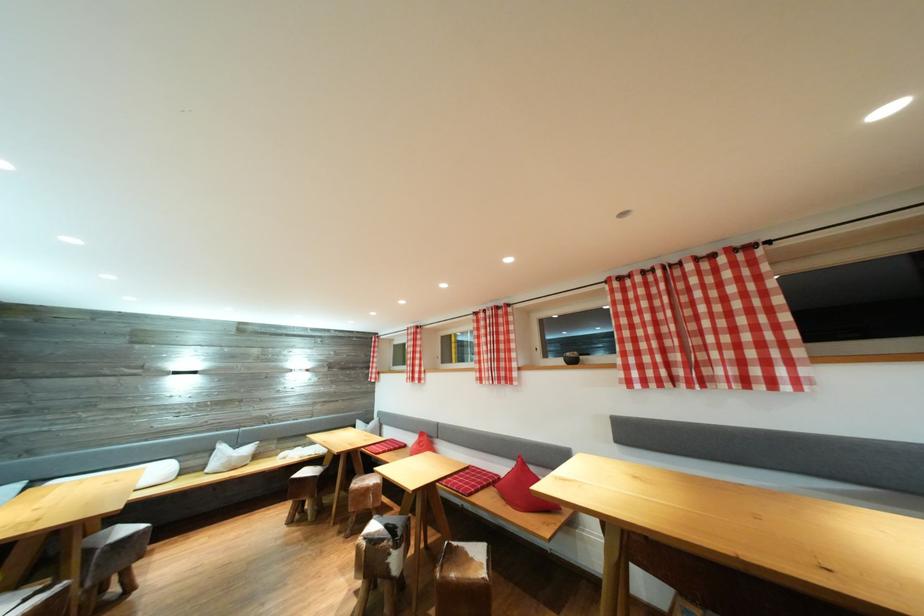
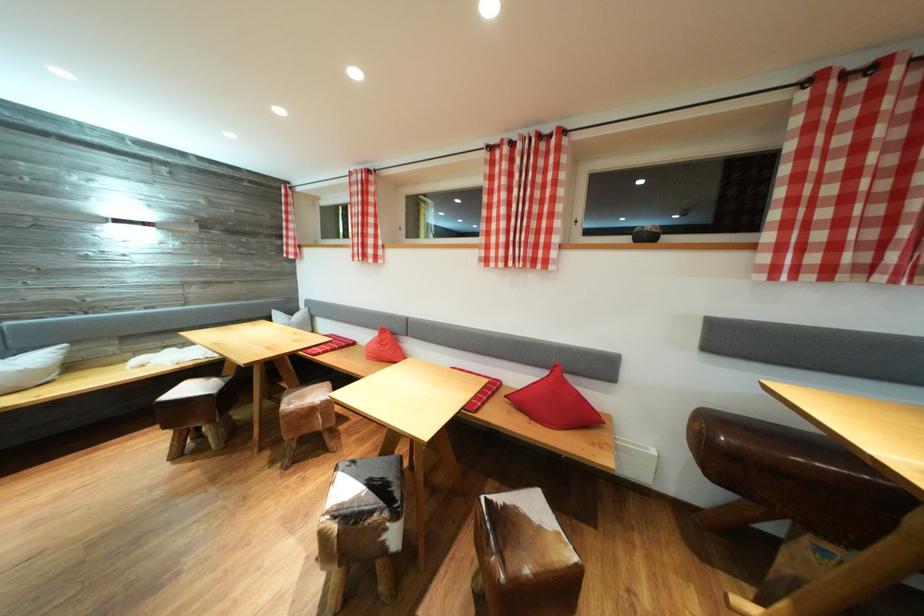
Find the pixel in the second image that matches the point at 244,451 in the first image.

(14, 358)